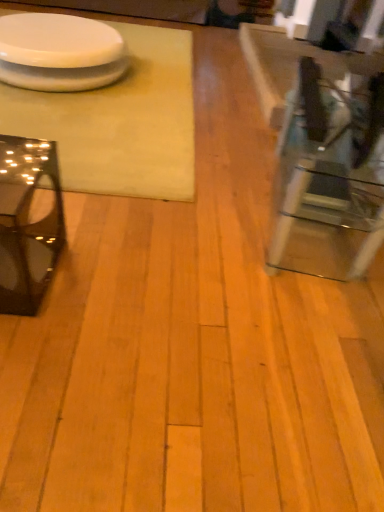
This screenshot has width=384, height=512. I want to click on vacant space to the right of glossy black glass table at left, which is the second table in right-to-left order, so click(x=102, y=284).